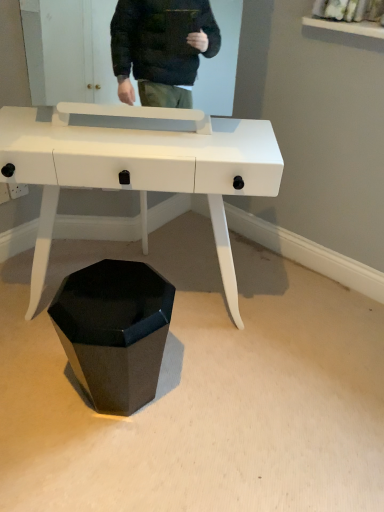
I want to click on vacant space in front of white glossy desk at center, so click(x=153, y=437).